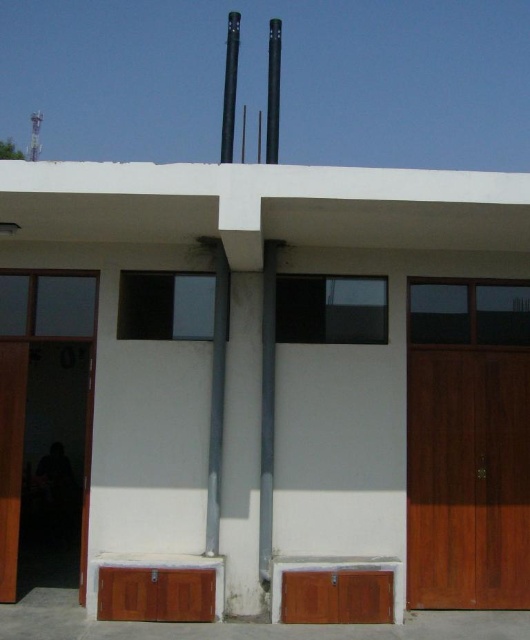
Question: Which point is farther from the camera taking this photo?

Choices:
 (A) (526, 433)
 (B) (3, 451)

Answer: (A)

Question: Does wooden door at right appear under wooden door at left?

Choices:
 (A) no
 (B) yes

Answer: (B)

Question: Can you confirm if wooden door at right is smaller than wooden door at left?

Choices:
 (A) yes
 (B) no

Answer: (B)

Question: Can you confirm if wooden door at right is positioned to the left of wooden door at left?

Choices:
 (A) no
 (B) yes

Answer: (A)

Question: Which object appears closest to the camera in this image?

Choices:
 (A) wooden door at left
 (B) wooden door at right

Answer: (A)

Question: Which object is closer to the camera taking this photo?

Choices:
 (A) wooden door at right
 (B) wooden door at left

Answer: (B)